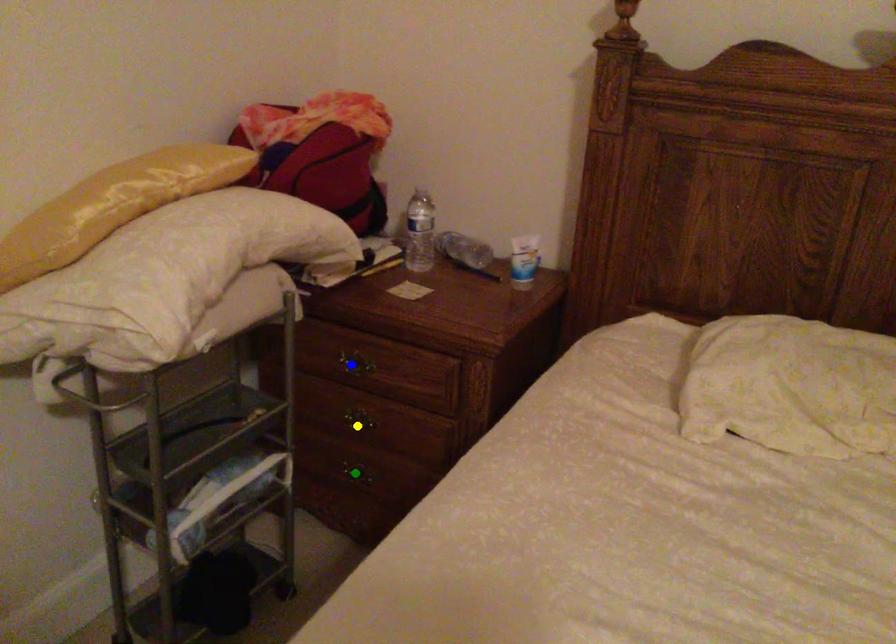
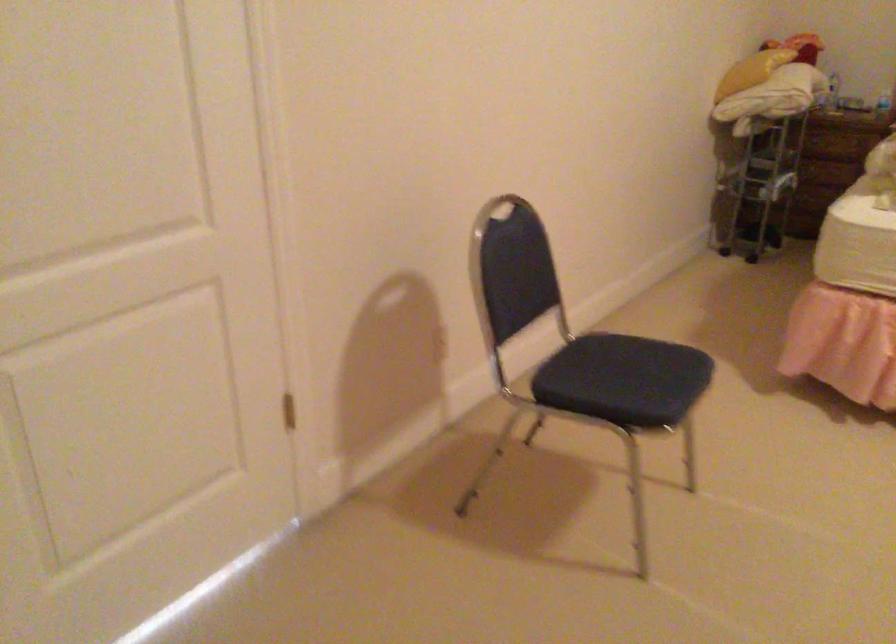
I am providing you with two images of the same scene from different viewpoints. Three points are marked in image1. Which point corresponds to a part or object that is occluded in image2?In image1, three points are marked. Which of them correspond to a part or object that is occluded in image2?Among the three points shown in image1, which one corresponds to a part or object that is no longer visible due to occlusion in image2?

blue point, green point, yellow point cannot be seen in image2.